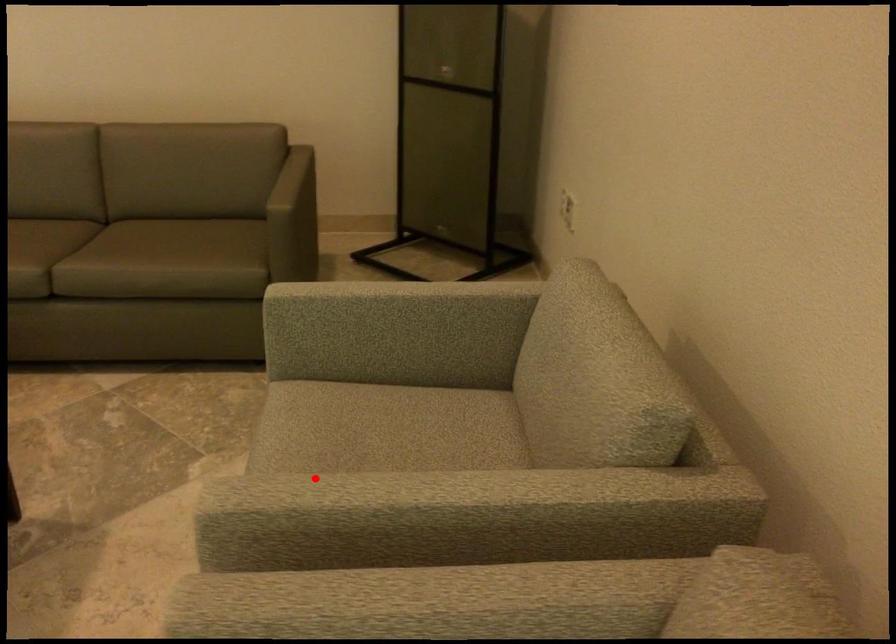
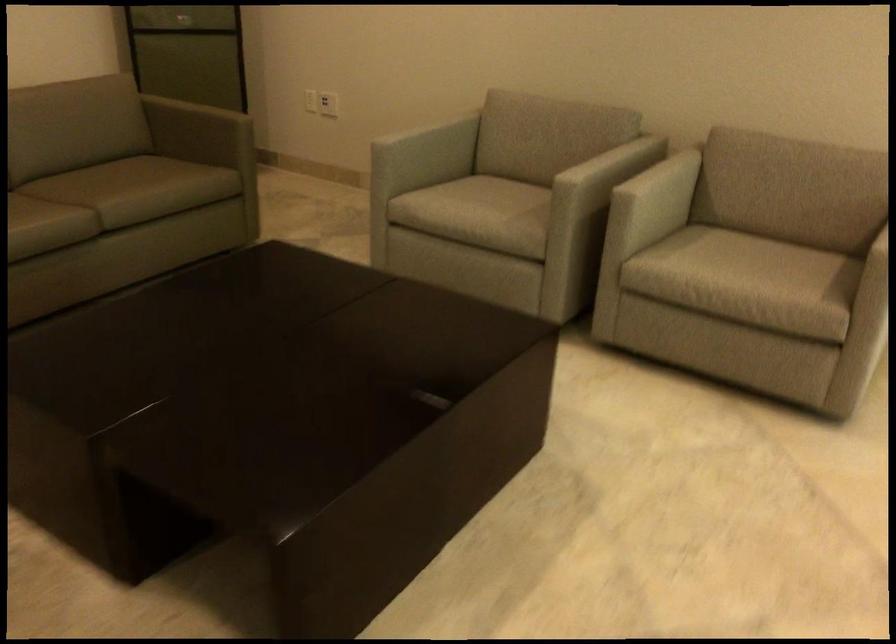
Question: I am providing you with two images of the same scene from different viewpoints. Given a red point in image1, look at the same physical point in image2. Is it:

Choices:
 (A) Closer to the viewpoint
 (B) Farther from the viewpoint

Answer: (B)